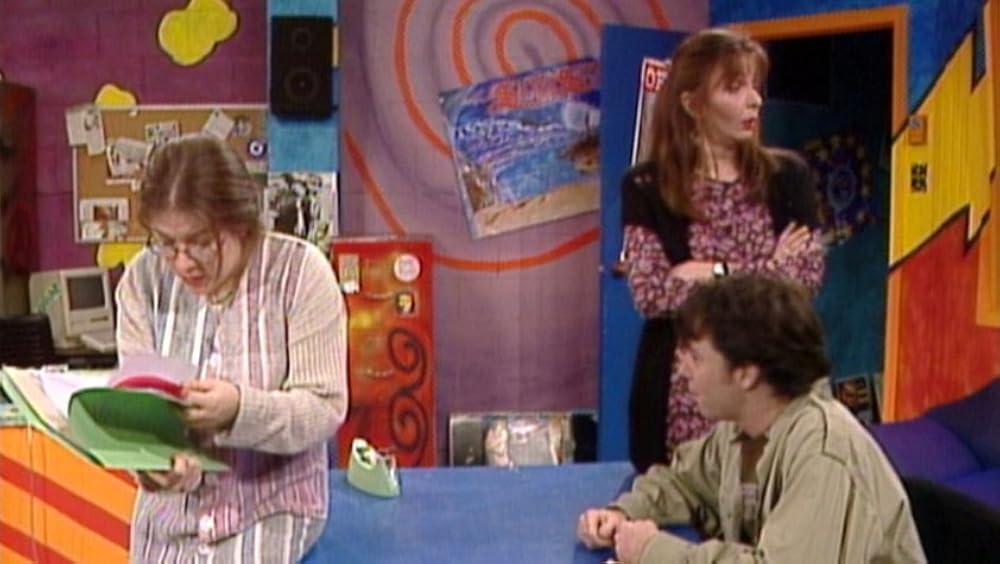
The width and height of the screenshot is (1000, 564). I want to click on door, so click(627, 92).